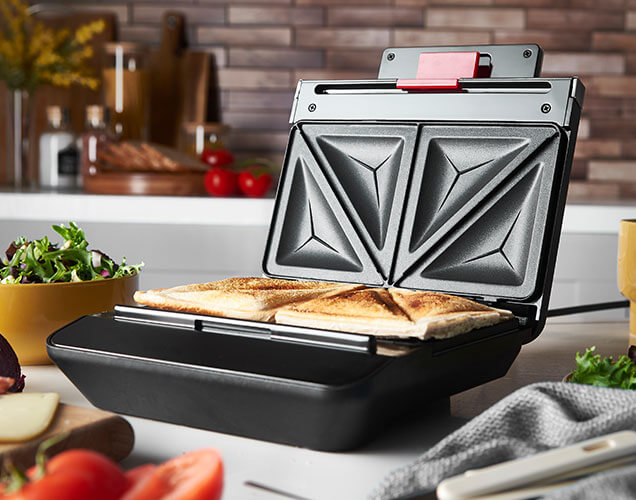
The width and height of the screenshot is (636, 500). Identify the location of grey tablecloth. (534, 412).